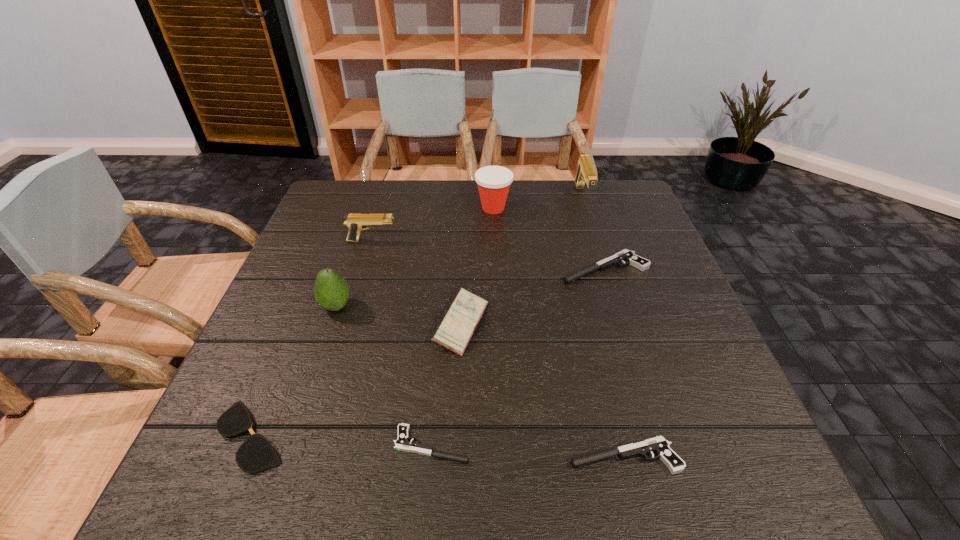
Locate an element on the screen. vacant space that satisfies the following two spatial constraints: 1. at the barrel of the right tan pistol; 2. on the front-facing side of the fourth farthest object is located at coordinates (606, 268).